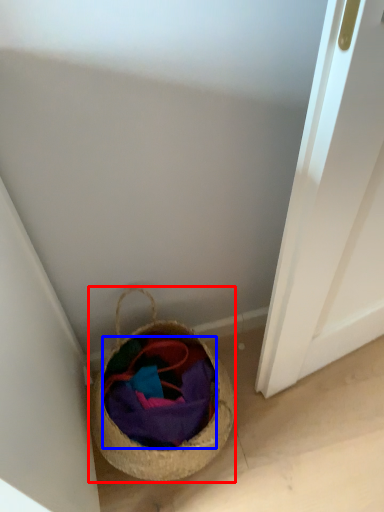
Question: Which object appears farthest to the camera in this image, basket (highlighted by a red box) or fabric (highlighted by a blue box)?

Choices:
 (A) basket
 (B) fabric

Answer: (B)